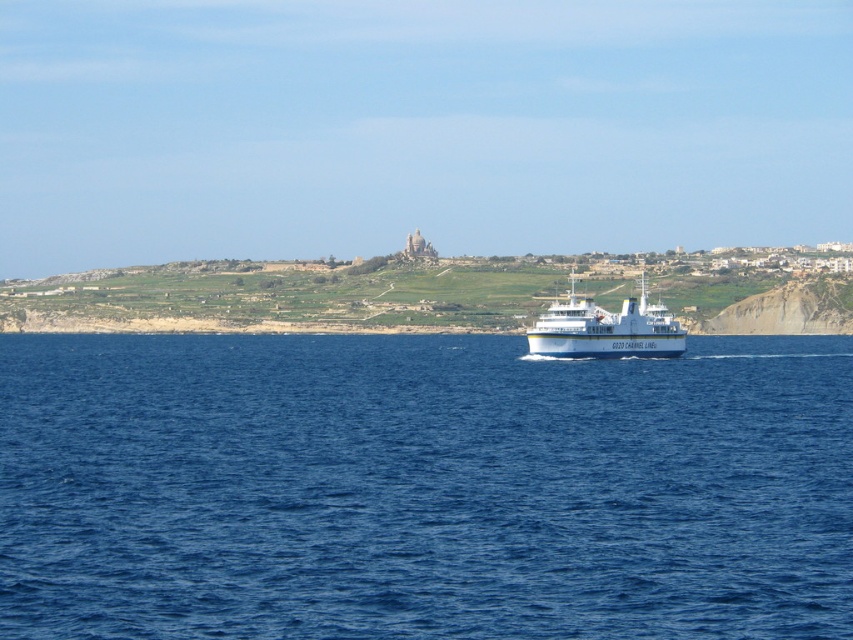
Question: Where is blue water at center located in relation to white glossy cruise ship at center in the image?

Choices:
 (A) above
 (B) below

Answer: (B)

Question: Is the position of blue water at center less distant than that of white glossy cruise ship at center?

Choices:
 (A) no
 (B) yes

Answer: (B)

Question: Among these objects, which one is nearest to the camera?

Choices:
 (A) white glossy cruise ship at center
 (B) blue water at center

Answer: (B)

Question: Does blue water at center come behind white glossy cruise ship at center?

Choices:
 (A) yes
 (B) no

Answer: (B)

Question: Among these objects, which one is nearest to the camera?

Choices:
 (A) white glossy cruise ship at center
 (B) blue water at center

Answer: (B)

Question: Which object is farther from the camera taking this photo?

Choices:
 (A) blue water at center
 (B) white glossy cruise ship at center

Answer: (B)